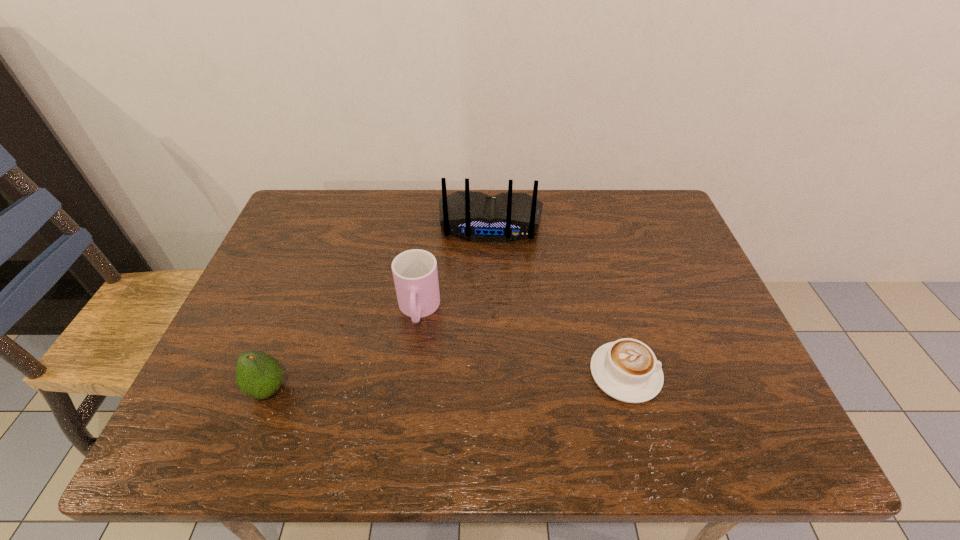
Image resolution: width=960 pixels, height=540 pixels. Find the location of `vacant spot on the desktop that is between the leftmost object and the shortest object and is positioned on the back of the farthest object`. vacant spot on the desktop that is between the leftmost object and the shortest object and is positioned on the back of the farthest object is located at coordinates (482, 380).

Where is `vacant spot on the desktop that is between the leftmost object and the rightmost object and is positioned with the handle on the side of the second farthest object`? This screenshot has height=540, width=960. vacant spot on the desktop that is between the leftmost object and the rightmost object and is positioned with the handle on the side of the second farthest object is located at coordinates (412, 383).